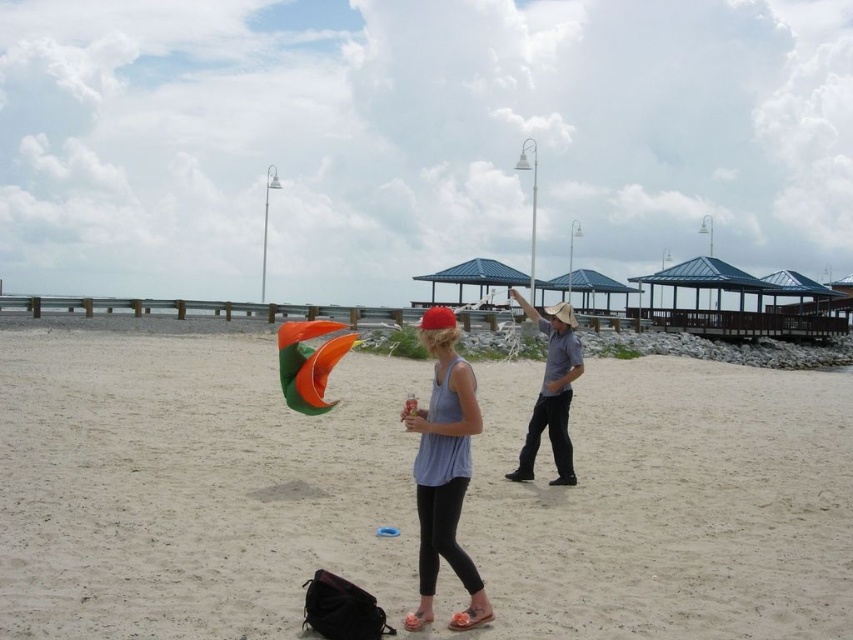
Is white sand at center in front of matte blue tank top at center?

That is True.

Does point (827, 381) come behind point (444, 436)?

Yes.

I want to click on white sand at center, so coord(412,496).

Who is positioned more to the left, matte blue tank top at center or gray cotton shirt at center?

matte blue tank top at center is more to the left.

Is matte blue tank top at center below gray cotton shirt at center?

Yes.

Is point (421, 536) less distant than point (532, 412)?

Yes, point (421, 536) is closer to viewer.

You are a GUI agent. You are given a task and a screenshot of the screen. Output one action in this format:
    pyautogui.click(x=<x>, y=<y>)
    Task: Click on the matte blue tank top at center
    
    Given the screenshot: What is the action you would take?
    pyautogui.click(x=444, y=470)

Does gray cotton shirt at center have a greater width compared to orange matte kite at center?

Incorrect, gray cotton shirt at center's width does not surpass orange matte kite at center's.

Who is more forward, [520,464] or [337,355]?

Point [520,464] is in front.

The image size is (853, 640). I want to click on gray cotton shirt at center, so (550, 392).